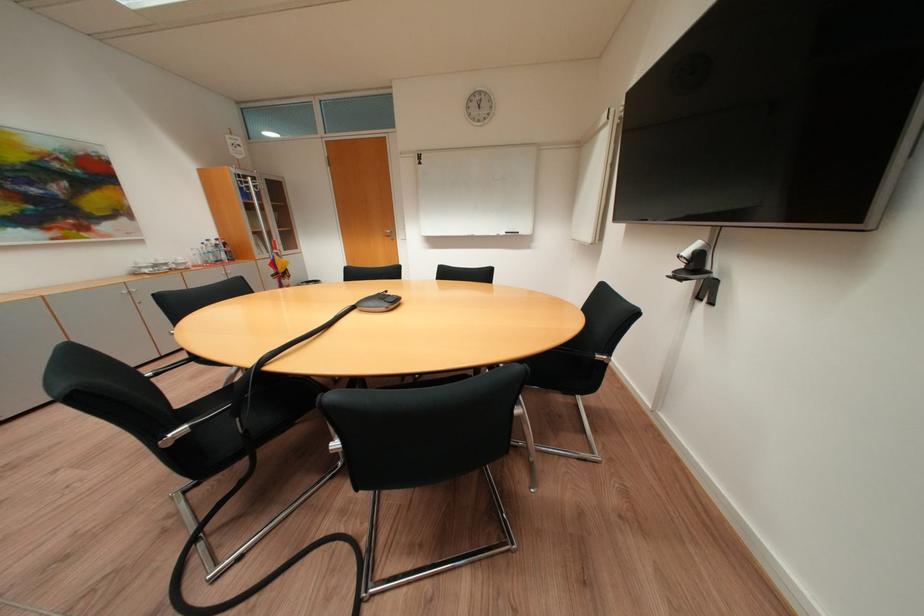
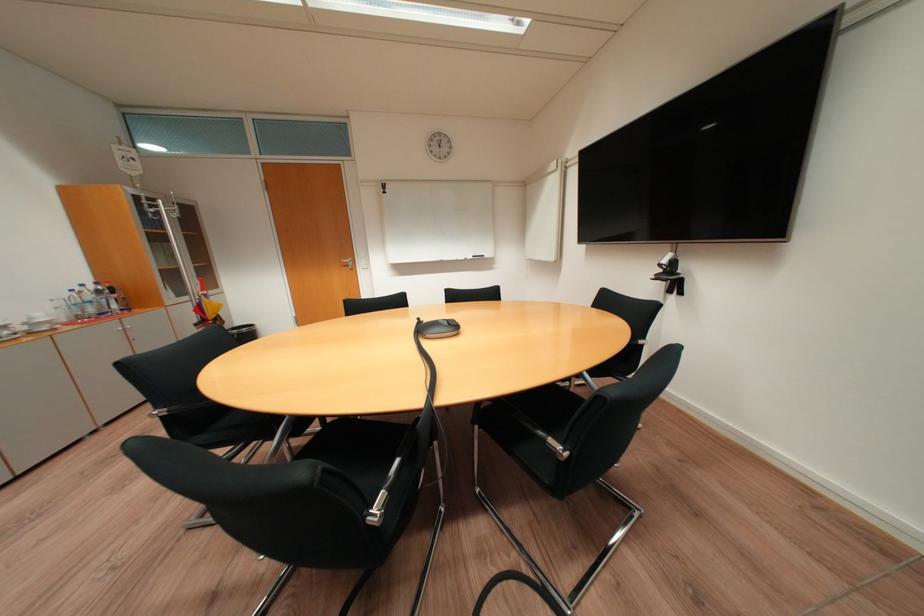
Where in the second image is the point corresponding to (x=181, y=267) from the first image?

(31, 330)